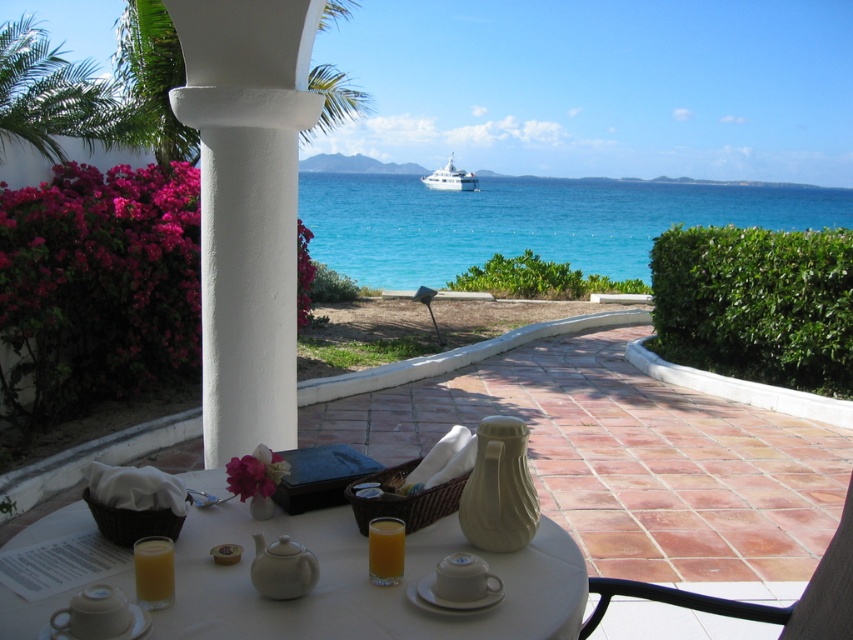
Question: Which of these objects is positioned closest to the white stucco column at center?

Choices:
 (A) white glossy yacht at center
 (B) brown leather chair at lower right
 (C) white ceramic table at center

Answer: (C)

Question: Can you confirm if white stucco column at center is positioned to the left of orange liquid at center?

Choices:
 (A) yes
 (B) no

Answer: (A)

Question: Does white stucco column at center have a larger size compared to white glossy yacht at center?

Choices:
 (A) no
 (B) yes

Answer: (A)

Question: Can you confirm if blue water at center is positioned to the left of brown leather chair at lower right?

Choices:
 (A) yes
 (B) no

Answer: (B)

Question: Which point is farther from the camera taking this photo?

Choices:
 (A) (457, 189)
 (B) (827, 550)
 (C) (396, 538)
 (D) (412, 192)

Answer: (A)

Question: Which of the following is the closest to the observer?

Choices:
 (A) tap(323, 573)
 (B) tap(277, 20)
 (C) tap(834, 192)

Answer: (A)